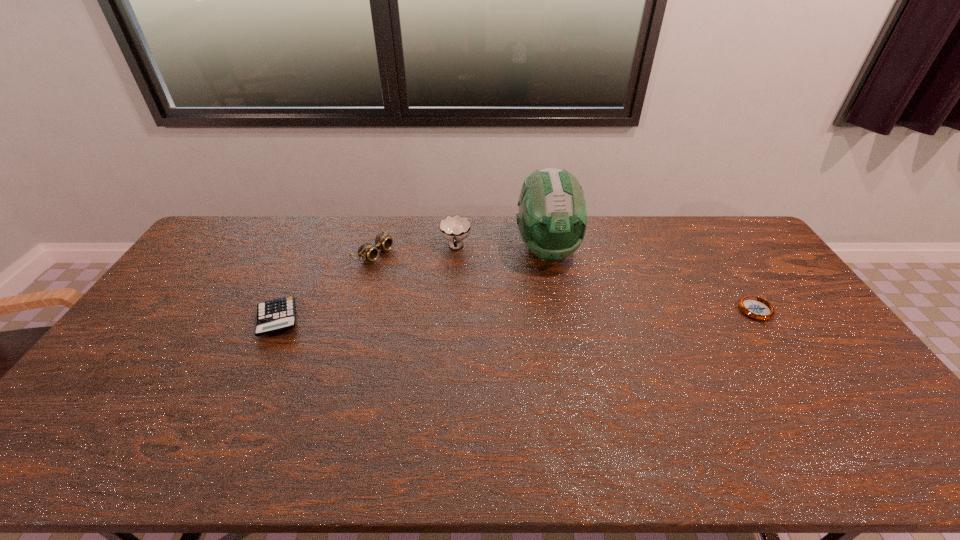
The height and width of the screenshot is (540, 960). Identify the location of vacant space that is in between the tallest object and the rightmost object. (652, 281).

You are a GUI agent. You are given a task and a screenshot of the screen. Output one action in this format:
    pyautogui.click(x=<x>, y=<y>)
    Task: Click on the free space between the third object from right to left and the football helmet
    The height and width of the screenshot is (540, 960).
    Given the screenshot: What is the action you would take?
    pyautogui.click(x=501, y=248)

Where is `vacant area that lies between the leftmost object and the fourth shortest object`? The width and height of the screenshot is (960, 540). vacant area that lies between the leftmost object and the fourth shortest object is located at coordinates (367, 284).

The image size is (960, 540). Find the location of `free area in between the second object from right to left and the compass`. free area in between the second object from right to left and the compass is located at coordinates click(652, 281).

Locate an element on the screen. The image size is (960, 540). vacant area between the second object from left to right and the fourth shortest object is located at coordinates (415, 250).

The width and height of the screenshot is (960, 540). What are the coordinates of `empty location between the fourth object from left to right and the second tallest object` in the screenshot? It's located at (501, 248).

Locate an element on the screen. The height and width of the screenshot is (540, 960). free area in between the compass and the third shortest object is located at coordinates (565, 282).

The image size is (960, 540). In order to click on empty space that is in between the shortest object and the goggles in this screenshot , I will do `click(565, 282)`.

Identify the location of vacant space that's between the tallest object and the cup. This screenshot has height=540, width=960. (501, 248).

Locate an element on the screen. The width and height of the screenshot is (960, 540). vacant space in between the second object from left to right and the cup is located at coordinates (415, 250).